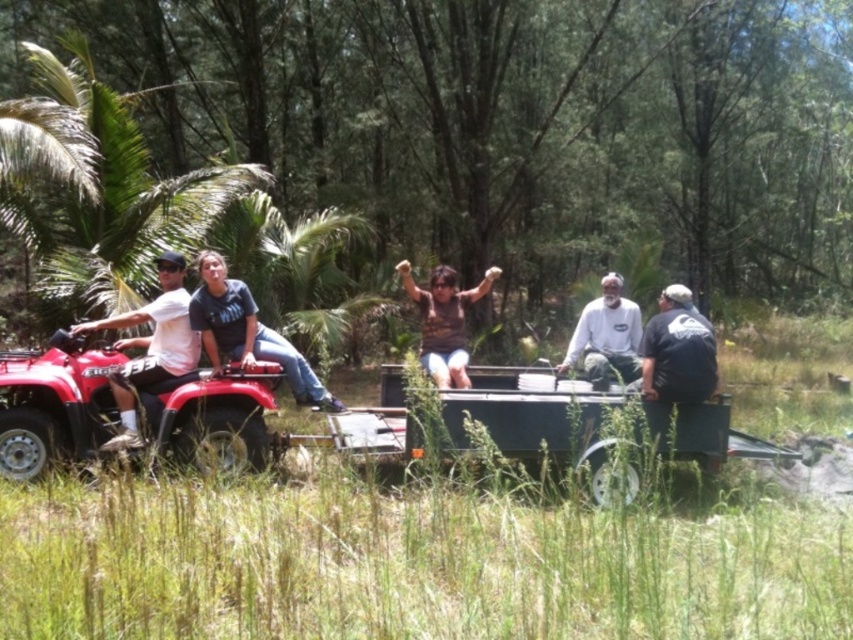
Is white matte shirt on the left further to camera compared to black matte shirt at right?

That is False.

Who is higher up, white matte shirt on the left or black matte shirt at right?

black matte shirt at right

Which is behind, point (128, 342) or point (712, 346)?

Point (128, 342)

Identify the location of white matte shirt on the left. (149, 346).

Can you confirm if black matte shirt at right is positioned to the right of white matte shirt at center?

Yes, black matte shirt at right is to the right of white matte shirt at center.

Does black matte shirt at right have a greater height compared to white matte shirt at center?

No.

Find the location of a particular element. This screenshot has width=853, height=640. black matte shirt at right is located at coordinates (677, 349).

Is white matte shirt at center taller than brown matte shirt at center?

No.

Who is shorter, white matte shirt at center or brown matte shirt at center?

Standing shorter between the two is white matte shirt at center.

Who is more distant from viewer, (611, 289) or (474, 296)?

The point (611, 289) is behind.

What are the coordinates of `white matte shirt at center` in the screenshot? It's located at (606, 337).